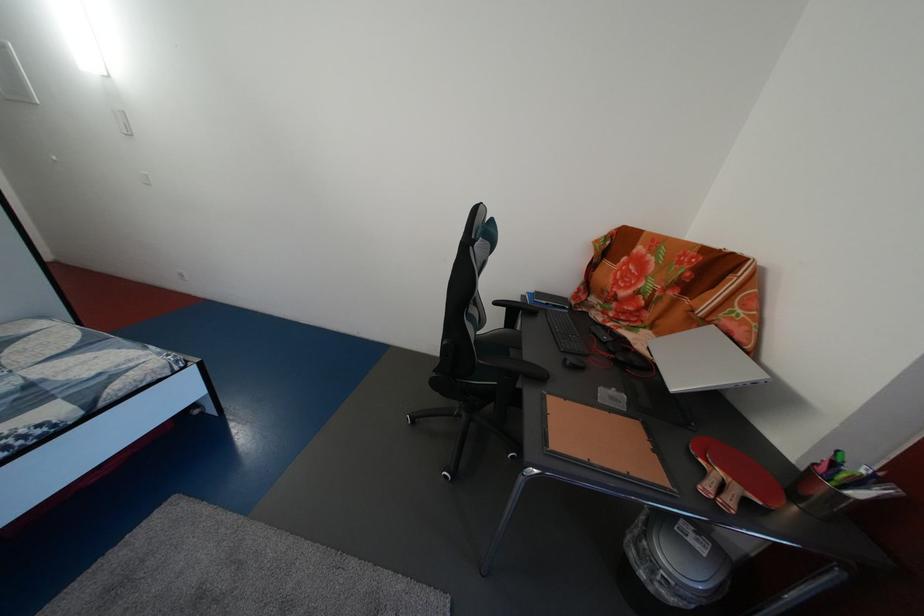
What do you see at coordinates (499, 342) in the screenshot? I see `a chair sitting surface` at bounding box center [499, 342].